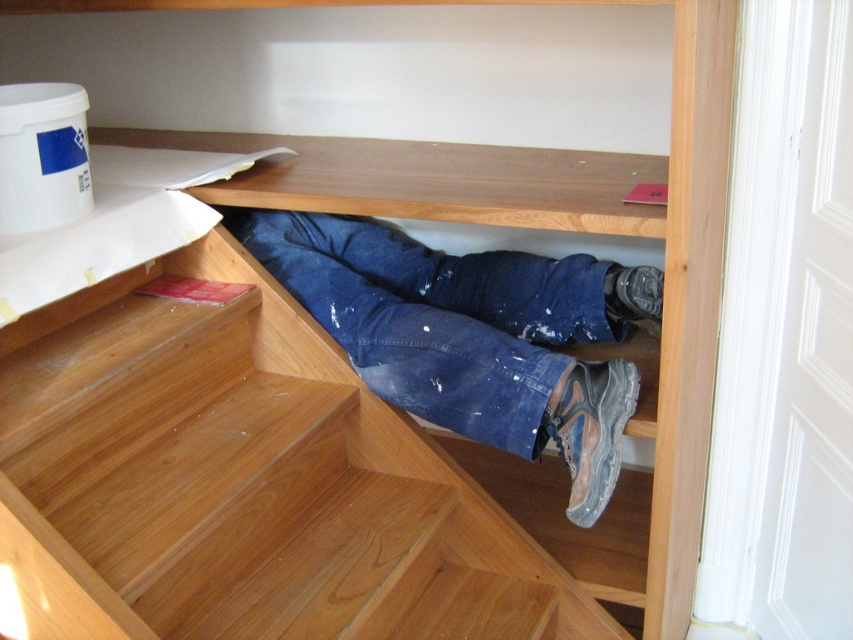
Question: Can you confirm if wooden stairs at center is wider than blue jeans at center?

Choices:
 (A) yes
 (B) no

Answer: (A)

Question: Which object is closer to the camera taking this photo?

Choices:
 (A) blue jeans at center
 (B) wooden stairs at center

Answer: (B)

Question: Does wooden stairs at center have a greater width compared to blue jeans at center?

Choices:
 (A) yes
 (B) no

Answer: (A)

Question: Is wooden stairs at center bigger than blue jeans at center?

Choices:
 (A) yes
 (B) no

Answer: (A)